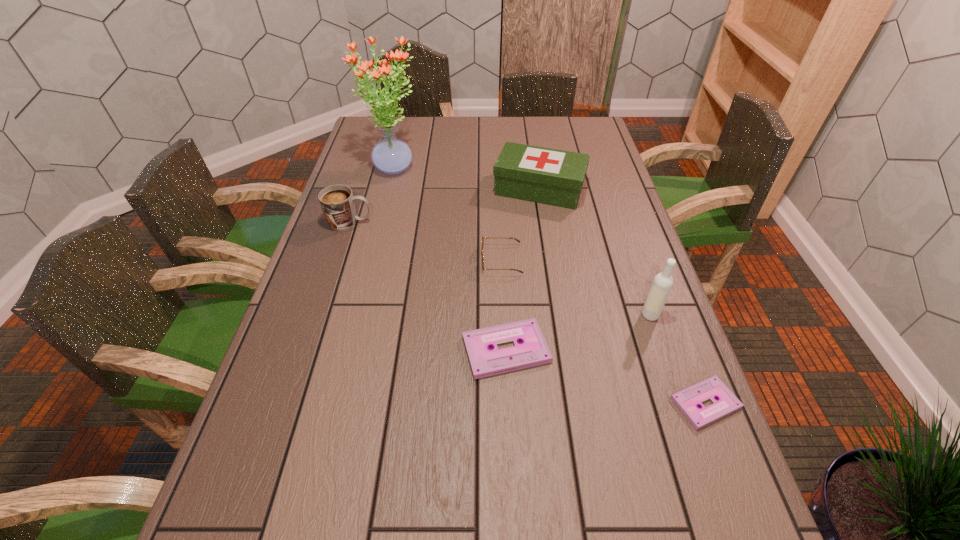
Identify the location of vodka. (662, 284).

The image size is (960, 540). What are the coordinates of `vacant space situated on the front of the left videotape` in the screenshot? It's located at (512, 458).

What are the coordinates of `free location located on the back of the shortest object` in the screenshot? It's located at (666, 301).

Find the location of a particular element. The image size is (960, 540). free location located 0.310m on the left of the first-aid kit is located at coordinates (398, 190).

Locate an element on the screen. The image size is (960, 540). free space located on the right of the flower arrangement is located at coordinates (517, 167).

Locate an element on the screen. This screenshot has width=960, height=540. vacant space located on the lenses of the third shortest object is located at coordinates (344, 260).

Locate an element on the screen. Image resolution: width=960 pixels, height=540 pixels. vacant space located 0.100m on the lenses of the third shortest object is located at coordinates (444, 260).

Find the location of `vacant area situated 0.080m on the lenses of the third shortest object`. vacant area situated 0.080m on the lenses of the third shortest object is located at coordinates (452, 260).

Where is `free point located on the side of the third farthest object with the handle`? Image resolution: width=960 pixels, height=540 pixels. free point located on the side of the third farthest object with the handle is located at coordinates (393, 222).

Find the location of a particular element. vacant space located 0.130m on the back of the second tallest object is located at coordinates (635, 271).